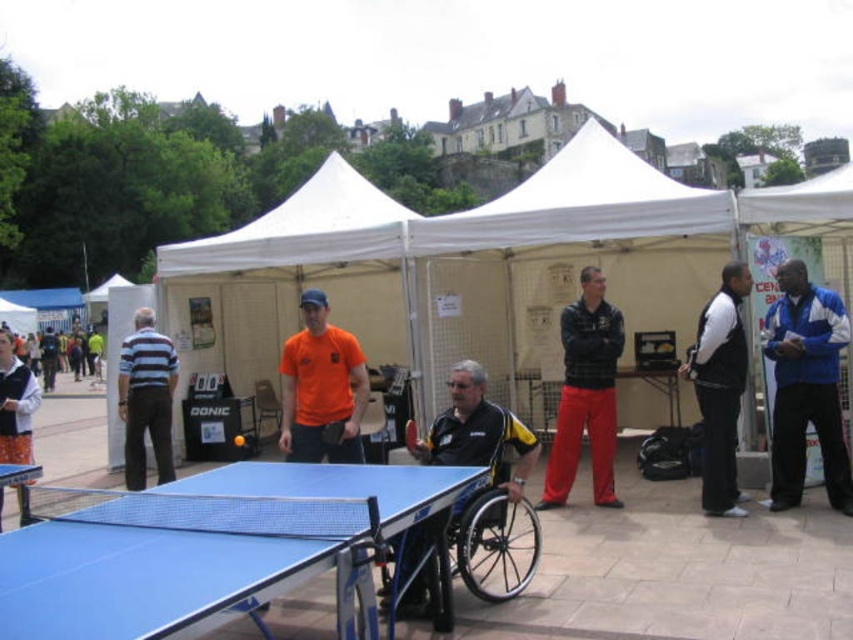
You are a photographer at the event and want to capture a photo of the striped cotton shirt at left and orange fabric pants at lower left. Which of the two items should you focus on first if you want to include both in the frame without moving the camera?

The striped cotton shirt at left should be focused on first because it is located below the orange fabric pants at lower left, so adjusting the camera angle to capture both would require ensuring the lower positioned item is in frame first.

You are organizing a photo shoot and need to place a small prop between the striped cotton shirt at left and the orange fabric pants at lower left. Which object should the prop be closer to to ensure it fits within the scene?

The striped cotton shirt at left has a smaller size compared to orange fabric pants at lower left, so the prop should be placed closer to the orange fabric pants at lower left to accommodate its larger size.

You are a person who wants to place a large box on the blue plastic table at lower left and the blue plastic table tennis table at center. Which one can you place the box on if the box requires a surface higher than 1 meter?

The blue plastic table at lower left is much taller than the blue plastic table tennis table at center, so you can place the box on the blue plastic table at lower left.